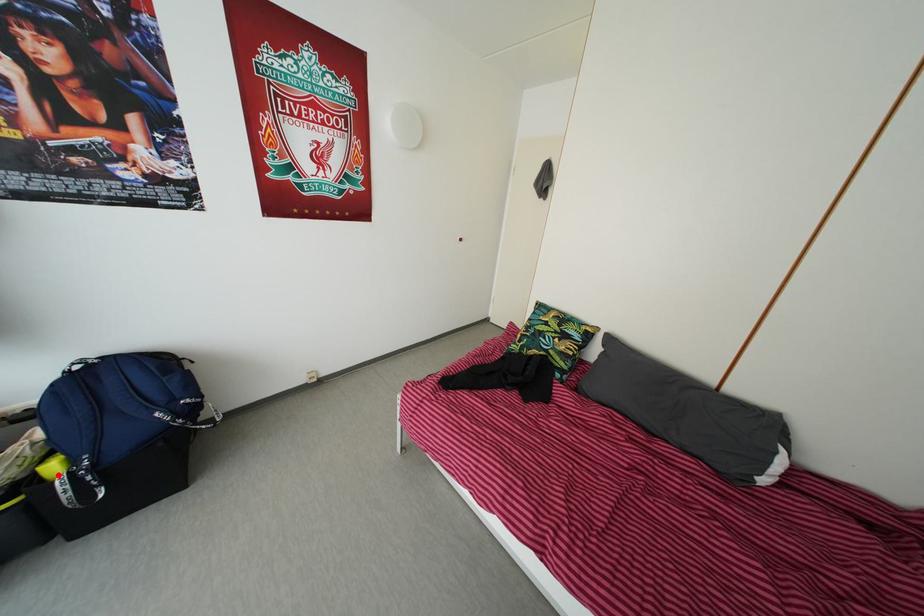
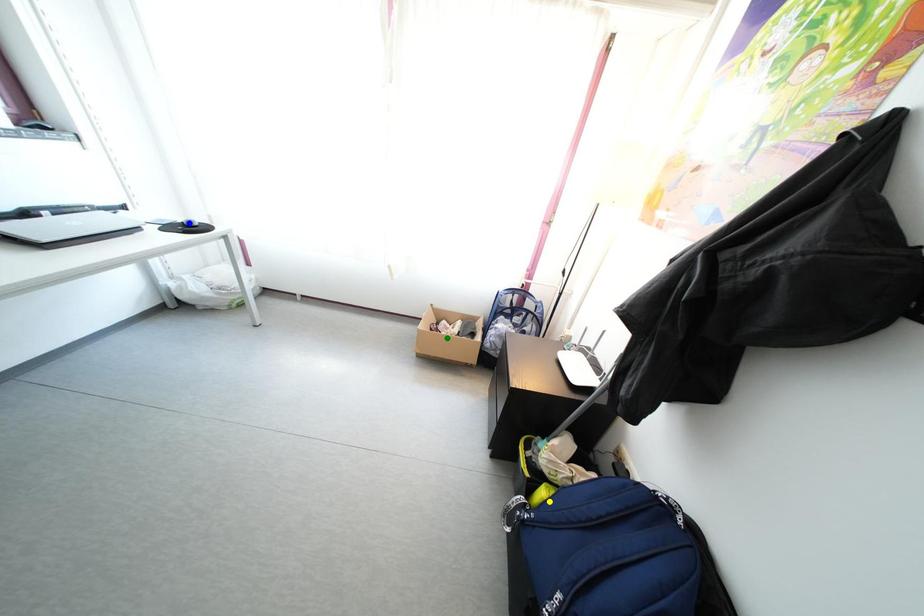
Question: I am providing you with two images of the same scene from different viewpoints. A red point is marked on the first image. You are given multiple points on the second image. Can you choose the point in image 2 that corresponds to the point in image 1?

Choices:
 (A) blue point
 (B) green point
 (C) yellow point

Answer: (C)